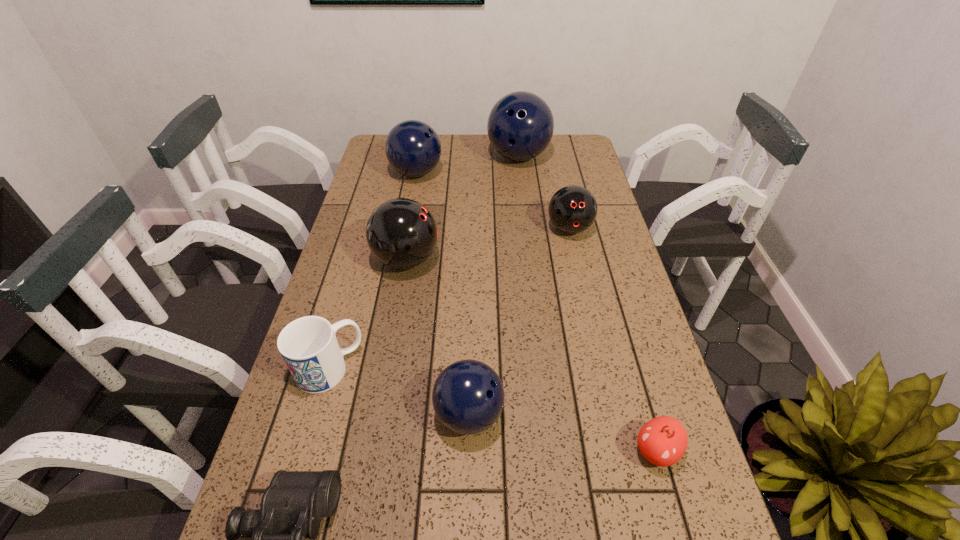
The height and width of the screenshot is (540, 960). Identify the location of blue bowling ball that is the third closest to the right black bowling ball. (468, 397).

The width and height of the screenshot is (960, 540). What are the coordinates of `blue bowling ball that is the closest to the blue mug` in the screenshot? It's located at (468, 397).

Where is `blank area in the image that satisfies the following two spatial constraints: 1. on the surface of the left black bowling ball near the finger holes; 2. on the front side of the blue mug`? blank area in the image that satisfies the following two spatial constraints: 1. on the surface of the left black bowling ball near the finger holes; 2. on the front side of the blue mug is located at coordinates (388, 368).

At what (x,y) coordinates should I click in order to perform the action: click on vacant space that satisfies the following two spatial constraints: 1. on the surface of the smaller black bowling ball near the finger holes; 2. on the surface of the smallest blue bowling ball near the finger holes. Please return your answer as a coordinate pair (x, y). The height and width of the screenshot is (540, 960). Looking at the image, I should click on (612, 414).

Where is `vacant area that satisfies the following two spatial constraints: 1. on the surface of the biggest blue bowling ball near the finger holes; 2. on the surface of the left black bowling ball near the finger holes`? The height and width of the screenshot is (540, 960). vacant area that satisfies the following two spatial constraints: 1. on the surface of the biggest blue bowling ball near the finger holes; 2. on the surface of the left black bowling ball near the finger holes is located at coordinates (531, 260).

Identify the location of free space that satisfies the following two spatial constraints: 1. on the surface of the right black bowling ball near the finger holes; 2. on the surface of the left black bowling ball near the finger holes. (576, 260).

Locate an element on the screen. This screenshot has width=960, height=540. vacant region that satisfies the following two spatial constraints: 1. on the surface of the tallest bowling ball near the finger holes; 2. on the surface of the nearest blue bowling ball near the finger holes is located at coordinates (549, 414).

What are the coordinates of `vacant position in the image that satisfies the following two spatial constraints: 1. on the surface of the tallest bowling ball near the finger holes; 2. on the surface of the second biggest blue bowling ball near the finger holes` in the screenshot? It's located at (520, 173).